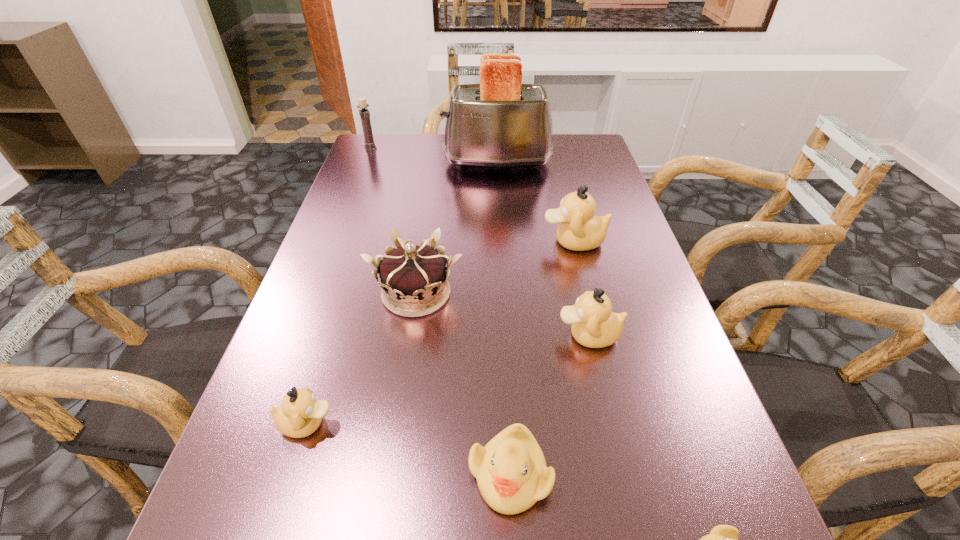
What are the coordinates of `the second duckling from left to right` in the screenshot? It's located at (511, 472).

Identify the location of the left yellow duckling. (511, 472).

You are a GUI agent. You are given a task and a screenshot of the screen. Output one action in this format:
    pyautogui.click(x=<x>, y=<y>)
    Task: Click on the blank space located 0.210m on the side of the gray toaster with the control lever
    
    Given the screenshot: What is the action you would take?
    pyautogui.click(x=372, y=163)

Locate an element on the screen. The image size is (960, 540). vacant space located on the side of the gray toaster with the control lever is located at coordinates (405, 163).

Image resolution: width=960 pixels, height=540 pixels. I want to click on vacant space situated on the side of the gray toaster with the control lever, so click(412, 163).

Image resolution: width=960 pixels, height=540 pixels. I want to click on vacant region located 0.330m on the front of the candle holder, so click(x=346, y=213).

Locate an element on the screen. free region located 0.400m on the face of the biggest tan duckling is located at coordinates (371, 241).

At what (x,y) coordinates should I click in order to perform the action: click on free spot located 0.280m on the face of the biggest tan duckling. Please return your answer as a coordinate pair (x, y). This screenshot has width=960, height=540. Looking at the image, I should click on (422, 241).

At what (x,y) coordinates should I click in order to perform the action: click on vacant region located 0.340m on the face of the biggest tan duckling. Please return your answer as a coordinate pair (x, y). This screenshot has width=960, height=540. Looking at the image, I should click on (396, 241).

Where is `blank space located on the front of the crown`? blank space located on the front of the crown is located at coordinates (385, 499).